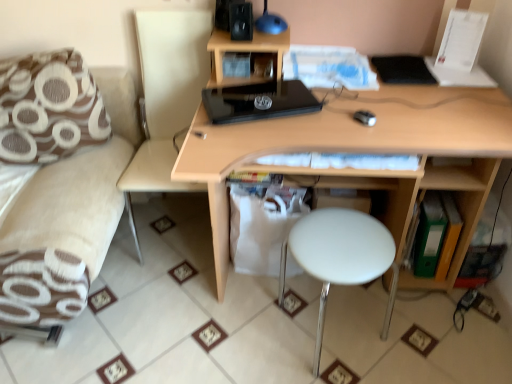
Locate an element on the screen. This screenshot has width=512, height=384. free space in front of green plastic folder at lower right is located at coordinates (457, 301).